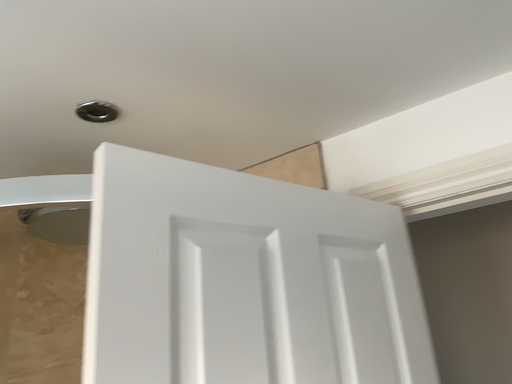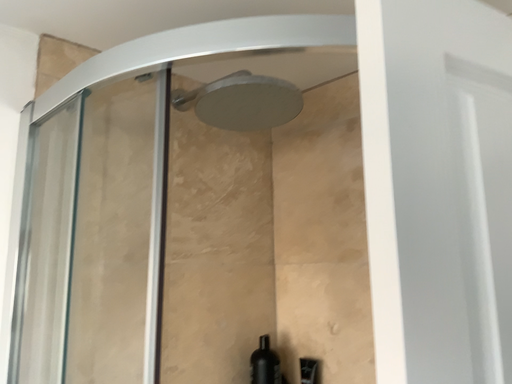
Question: Which way did the camera rotate in the video?

Choices:
 (A) rotated right
 (B) rotated left

Answer: (B)